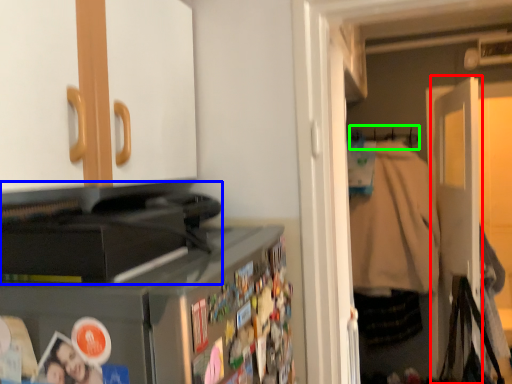
Question: Considering the real-world distances, which object is farthest from door (highlighted by a red box)? appliance (highlighted by a blue box) or hanger (highlighted by a green box)?

Choices:
 (A) appliance
 (B) hanger

Answer: (A)